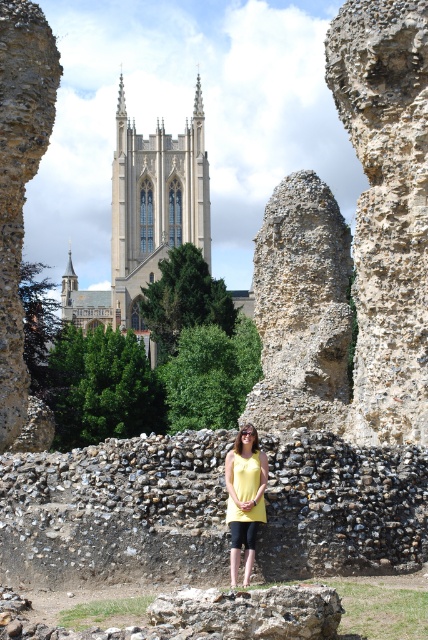
Question: Observing the image, what is the correct spatial positioning of light beige stone church at upper center in reference to yellow fabric top at center?

Choices:
 (A) right
 (B) left

Answer: (B)

Question: Which object appears farthest from the camera in this image?

Choices:
 (A) yellow fabric top at center
 (B) light beige stone church at upper center

Answer: (B)

Question: Does light beige stone church at upper center come in front of yellow fabric top at center?

Choices:
 (A) yes
 (B) no

Answer: (B)

Question: Does light beige stone church at upper center appear on the left side of yellow fabric top at center?

Choices:
 (A) no
 (B) yes

Answer: (B)

Question: Which point is closer to the camera?

Choices:
 (A) light beige stone church at upper center
 (B) yellow fabric top at center

Answer: (B)

Question: Which of the following is the closest to the observer?

Choices:
 (A) light beige stone church at upper center
 (B) yellow fabric top at center

Answer: (B)